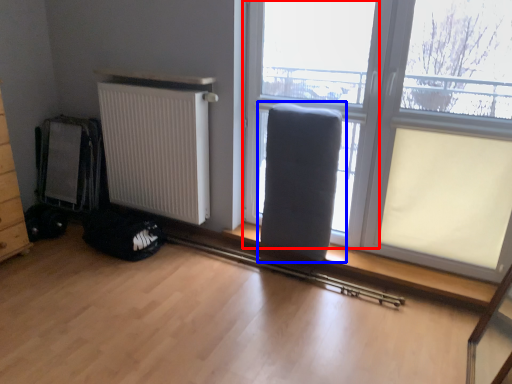
Question: Which point is closer to the camera, window frame (highlighted by a red box) or armchair (highlighted by a blue box)?

Choices:
 (A) window frame
 (B) armchair

Answer: (A)